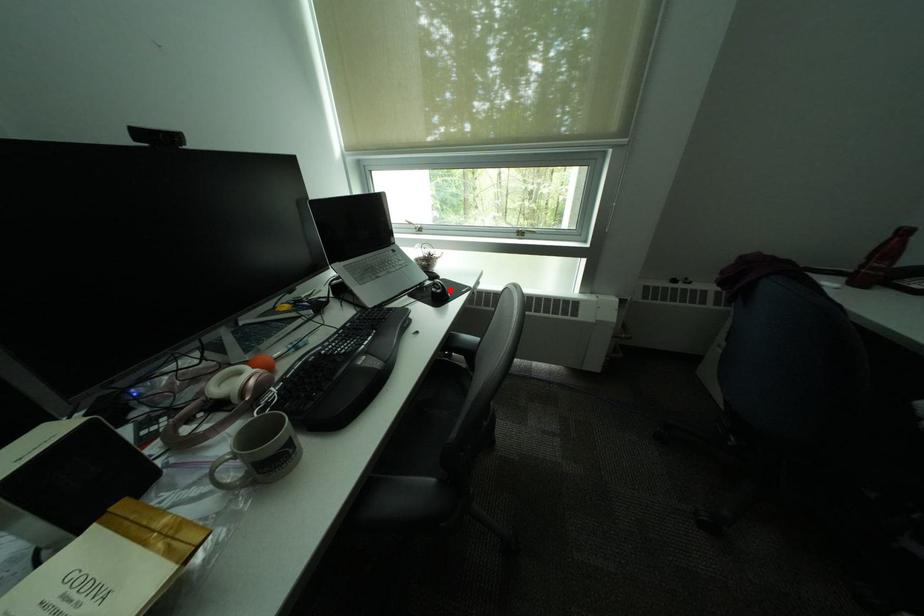
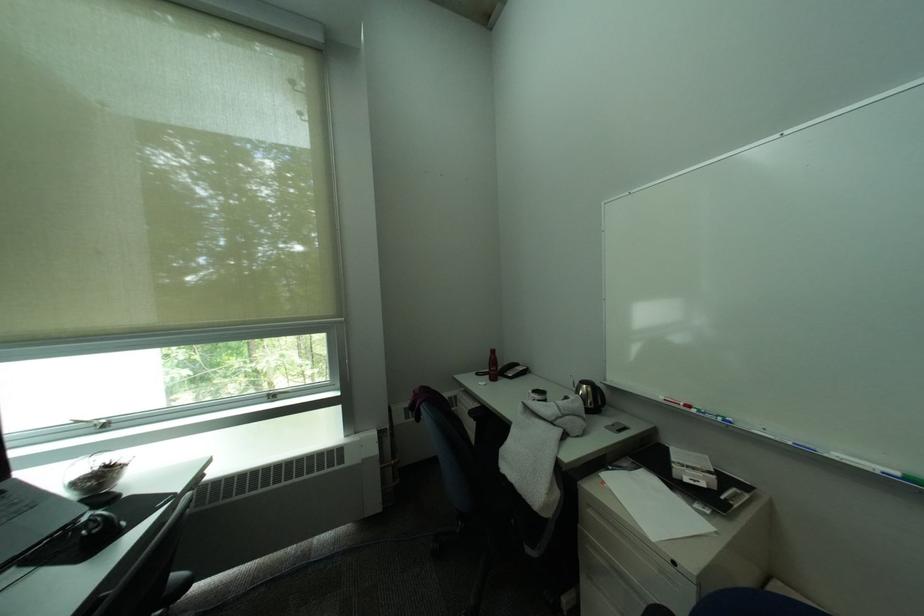
In the second image, find the point that corresponds to the highlighted location in the first image.

(106, 528)